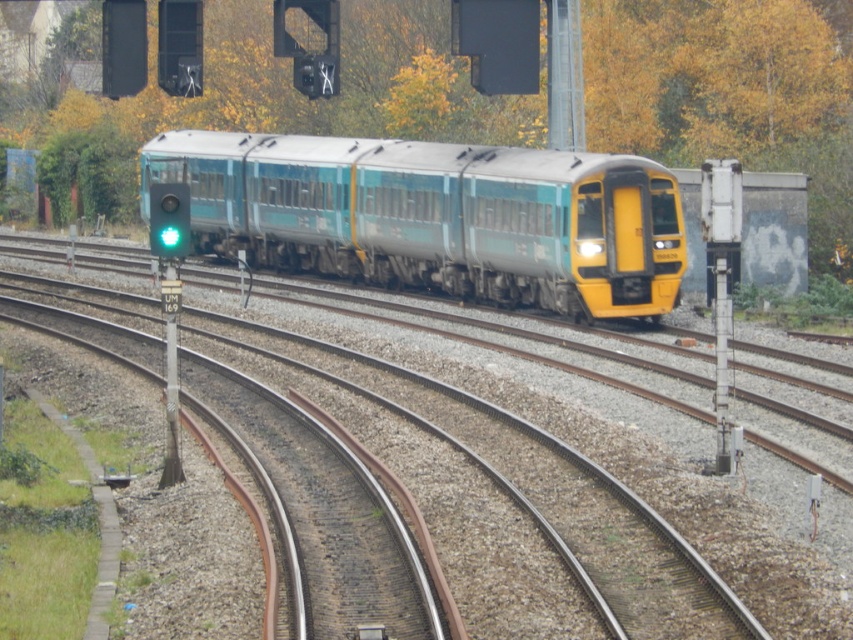
Which is more to the right, teal/grey metallic train at center or green glass traffic light at left?

teal/grey metallic train at center

Where is `teal/grey metallic train at center`? Image resolution: width=853 pixels, height=640 pixels. teal/grey metallic train at center is located at coordinates (437, 216).

Image resolution: width=853 pixels, height=640 pixels. In order to click on teal/grey metallic train at center in this screenshot , I will do `click(437, 216)`.

Does yellow-green leaves at upper center have a smaller size compared to green glass traffic light at left?

Actually, yellow-green leaves at upper center might be larger than green glass traffic light at left.

Describe the element at coordinates (729, 92) in the screenshot. Image resolution: width=853 pixels, height=640 pixels. I see `yellow-green leaves at upper center` at that location.

Describe the element at coordinates (729, 92) in the screenshot. I see `yellow-green leaves at upper center` at that location.

You are a GUI agent. You are given a task and a screenshot of the screen. Output one action in this format:
    pyautogui.click(x=<x>, y=<y>)
    Task: Click on the yellow-green leaves at upper center
    Image resolution: width=853 pixels, height=640 pixels.
    Given the screenshot: What is the action you would take?
    pyautogui.click(x=729, y=92)

Based on the photo, is yellow-green leaves at upper center positioned behind teal/grey metallic train at center?

Yes, it is behind teal/grey metallic train at center.

Is point (375, 52) positioned in front of point (457, 164)?

No, it is behind (457, 164).

Does point (730, 6) come farther from viewer compared to point (468, 182)?

Yes.

I want to click on yellow-green leaves at upper center, so click(729, 92).